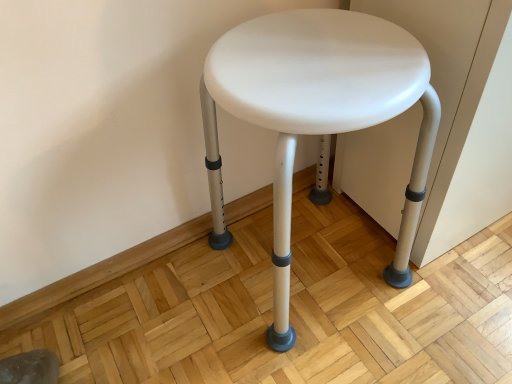
You are a GUI agent. You are given a task and a screenshot of the screen. Output one action in this format:
    pyautogui.click(x=<x>, y=<y>)
    Task: Click on the empty space that is ontop of white plastic stool at center
    
    Given the screenshot: What is the action you would take?
    pyautogui.click(x=308, y=61)